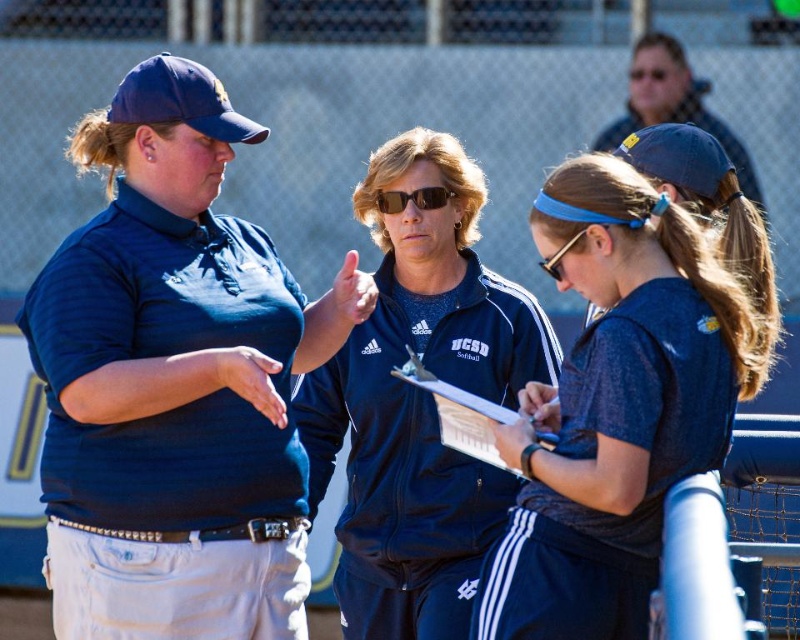
Does point (154, 243) come in front of point (436, 198)?

That is True.

Who is shorter, matte blue shirt at left or sunglasses at center?

sunglasses at center

The width and height of the screenshot is (800, 640). What do you see at coordinates (176, 381) in the screenshot?
I see `matte blue shirt at left` at bounding box center [176, 381].

Image resolution: width=800 pixels, height=640 pixels. I want to click on matte blue shirt at left, so click(x=176, y=381).

Who is shorter, blue fabric headband at center or matte plastic clipboard at center?

matte plastic clipboard at center

The image size is (800, 640). What do you see at coordinates (624, 397) in the screenshot?
I see `blue fabric headband at center` at bounding box center [624, 397].

Where is `blue fabric headband at center`? blue fabric headband at center is located at coordinates (624, 397).

Is matte blue shirt at left shorter than matte blue cap at upper center?

No, matte blue shirt at left is not shorter than matte blue cap at upper center.

Who is more forward, (212, 536) or (738, 179)?

Point (212, 536)

I want to click on matte blue shirt at left, so click(x=176, y=381).